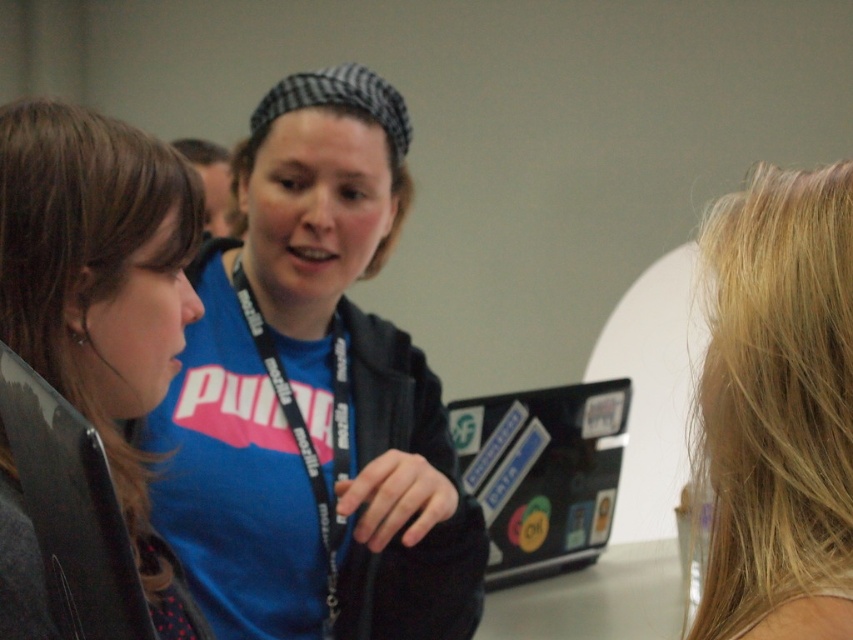
Is black matte laptop at center positioned at the back of black fabric lanyard at center?

Yes, black matte laptop at center is behind black fabric lanyard at center.

Between point (496, 432) and point (325, 596), which one is positioned behind?

The point (496, 432) is more distant.

I want to click on black matte laptop at center, so click(x=543, y=474).

Does point (163, 342) come closer to viewer compared to point (582, 420)?

Yes.

Who is more forward, (97,262) or (457,449)?

Point (97,262) is in front.

Find the location of `matte black laptop at left`. matte black laptop at left is located at coordinates click(x=102, y=292).

Image resolution: width=853 pixels, height=640 pixels. Find the location of `matte black laptop at left`. matte black laptop at left is located at coordinates (102, 292).

Between blonde hair at right and black matte laptop at center, which one appears on the left side from the viewer's perspective?

black matte laptop at center is more to the left.

What do you see at coordinates (778, 410) in the screenshot? I see `blonde hair at right` at bounding box center [778, 410].

Who is more forward, (762,276) or (576,497)?

Point (762,276) is in front.

Locate an element on the screen. blonde hair at right is located at coordinates (778, 410).